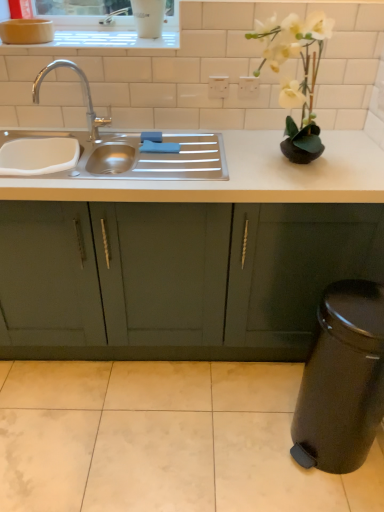
Question: Is white matte vase at upper right far away from stainless steel sink at left?

Choices:
 (A) no
 (B) yes

Answer: (A)

Question: Considering the relative sizes of white matte vase at upper right and stainless steel sink at left in the image provided, is white matte vase at upper right smaller than stainless steel sink at left?

Choices:
 (A) yes
 (B) no

Answer: (A)

Question: Is white matte vase at upper right oriented towards stainless steel sink at left?

Choices:
 (A) no
 (B) yes

Answer: (A)

Question: Can we say white matte vase at upper right lies outside stainless steel sink at left?

Choices:
 (A) no
 (B) yes

Answer: (B)

Question: Is white matte vase at upper right bigger than stainless steel sink at left?

Choices:
 (A) yes
 (B) no

Answer: (B)

Question: Based on their sizes in the image, would you say stainless steel sink at left is bigger or smaller than white ceramic window sill at upper center?

Choices:
 (A) small
 (B) big

Answer: (B)

Question: From a real-world perspective, is stainless steel sink at left positioned above or below white ceramic window sill at upper center?

Choices:
 (A) below
 (B) above

Answer: (A)

Question: Relative to white ceramic window sill at upper center, is stainless steel sink at left in front or behind?

Choices:
 (A) behind
 (B) front

Answer: (B)

Question: From the image's perspective, relative to white ceramic window sill at upper center, is stainless steel sink at left above or below?

Choices:
 (A) above
 (B) below

Answer: (B)

Question: Is stainless steel sink at left taller or shorter than matte green cabinets at center?

Choices:
 (A) short
 (B) tall

Answer: (A)

Question: From a real-world perspective, relative to matte green cabinets at center, is stainless steel sink at left vertically above or below?

Choices:
 (A) above
 (B) below

Answer: (A)

Question: In the image, is stainless steel sink at left on the left side or the right side of matte green cabinets at center?

Choices:
 (A) right
 (B) left

Answer: (B)

Question: Considering their positions, is stainless steel sink at left located in front of or behind matte green cabinets at center?

Choices:
 (A) front
 (B) behind

Answer: (A)

Question: Based on their sizes in the image, would you say white matte vase at upper right is bigger or smaller than white ceramic window sill at upper center?

Choices:
 (A) big
 (B) small

Answer: (A)

Question: In the image, is white matte vase at upper right positioned in front of or behind white ceramic window sill at upper center?

Choices:
 (A) front
 (B) behind

Answer: (A)